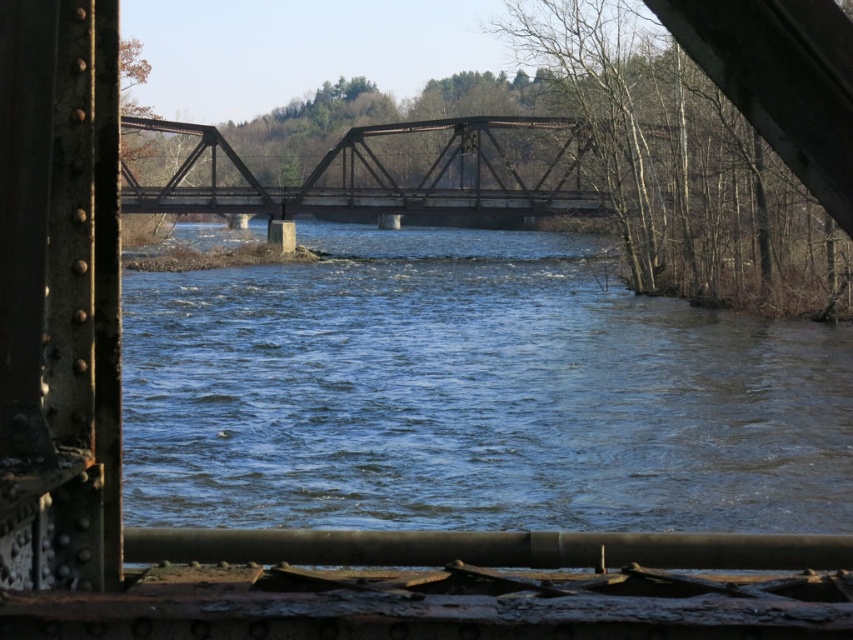
Question: Which of the following is the farthest from the observer?

Choices:
 (A) (531, 168)
 (B) (518, 461)

Answer: (A)

Question: Among these objects, which one is nearest to the camera?

Choices:
 (A) rusty metal bridge at center
 (B) blue water at center

Answer: (B)

Question: Can you confirm if blue water at center is smaller than rusty metal bridge at center?

Choices:
 (A) yes
 (B) no

Answer: (B)

Question: In this image, where is blue water at center located relative to rusty metal bridge at center?

Choices:
 (A) right
 (B) left

Answer: (A)

Question: Does blue water at center have a lesser width compared to rusty metal bridge at center?

Choices:
 (A) yes
 (B) no

Answer: (B)